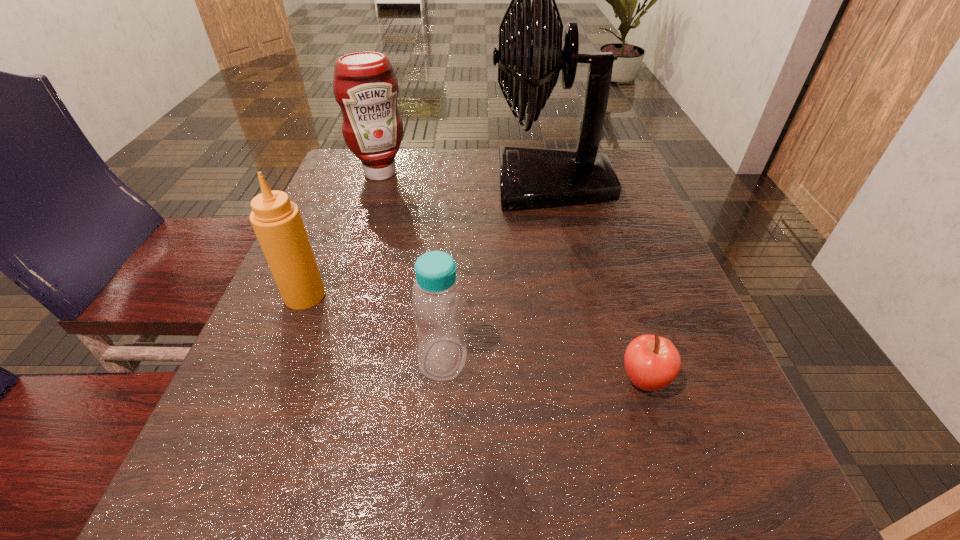
You are a GUI agent. You are given a task and a screenshot of the screen. Output one action in this format:
    pyautogui.click(x=<x>, y=<y>)
    Task: Click on the free space located on the back of the third farthest object
    
    Given the screenshot: What is the action you would take?
    pyautogui.click(x=337, y=215)

Find the location of `blank space located on the right of the bottle`. blank space located on the right of the bottle is located at coordinates (676, 359).

At what (x,y) coordinates should I click in order to perform the action: click on free region located on the front of the apple. Please return your answer as a coordinate pair (x, y). This screenshot has height=540, width=960. Looking at the image, I should click on (693, 536).

Locate an element on the screen. fan present at the far edge is located at coordinates (530, 56).

Locate an element on the screen. The height and width of the screenshot is (540, 960). condiment at the far edge is located at coordinates (365, 86).

Identify the location of fan at the right edge. (530, 56).

Identify the location of apple that is at the right edge. This screenshot has height=540, width=960. (652, 362).

This screenshot has height=540, width=960. Identify the location of object present at the far left corner. (365, 86).

At what (x,y) coordinates should I click in order to perform the action: click on object that is at the far right corner. Please return your answer as a coordinate pair (x, y). This screenshot has height=540, width=960. Looking at the image, I should click on (530, 56).

What are the coordinates of `vacant space at the far edge of the desktop` in the screenshot? It's located at (456, 186).